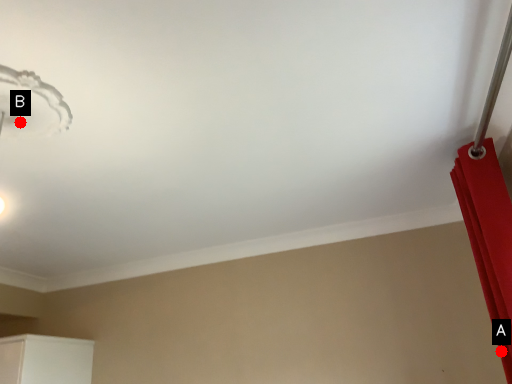
Question: Two points are circled on the image, labeled by A and B beside each circle. Which of the following is the farthest from the observer?

Choices:
 (A) A is further
 (B) B is further

Answer: (A)